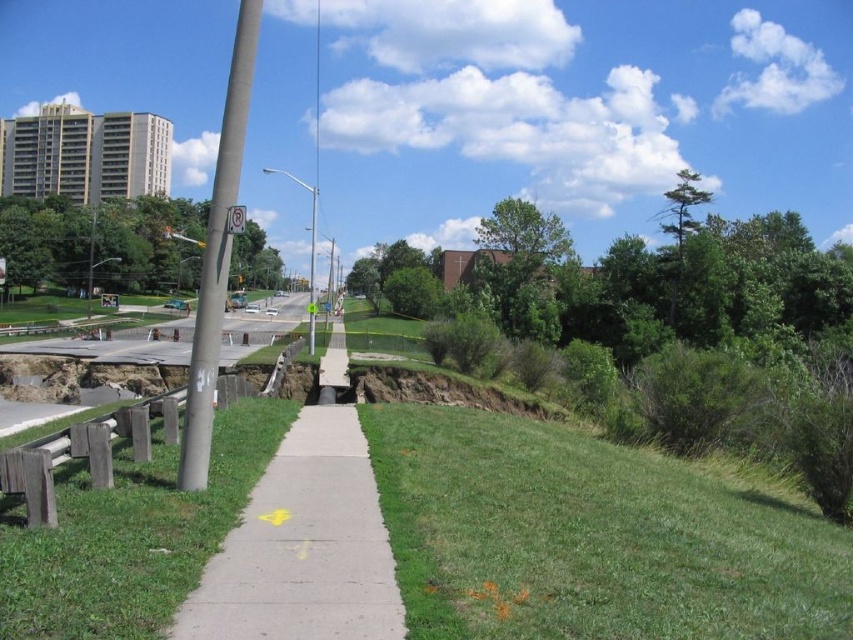
Looking at this image, which of these two, concrete sidewalk at center or concrete pole at left, stands shorter?

With less height is concrete sidewalk at center.

Is concrete sidewalk at center thinner than concrete pole at left?

Correct, concrete sidewalk at center's width is less than concrete pole at left's.

Is point (347, 500) farther from viewer compared to point (218, 154)?

No, (347, 500) is in front of (218, 154).

In order to click on concrete sidewalk at center in this screenshot , I will do `click(303, 547)`.

Which is more to the right, concrete sidewalk at center or green plastic sign at upper center?

concrete sidewalk at center is more to the right.

Between point (329, 480) and point (244, 225), which one is positioned behind?

The point (329, 480) is more distant.

Locate an element on the screen. This screenshot has height=640, width=853. concrete sidewalk at center is located at coordinates (303, 547).

Can you confirm if green grassy at lower right is smaller than concrete sidewalk at center?

Incorrect, green grassy at lower right is not smaller in size than concrete sidewalk at center.

Between point (590, 580) and point (352, 611), which one is positioned behind?

The point (590, 580) is behind.

Where is `green grassy at lower right`? green grassy at lower right is located at coordinates (590, 538).